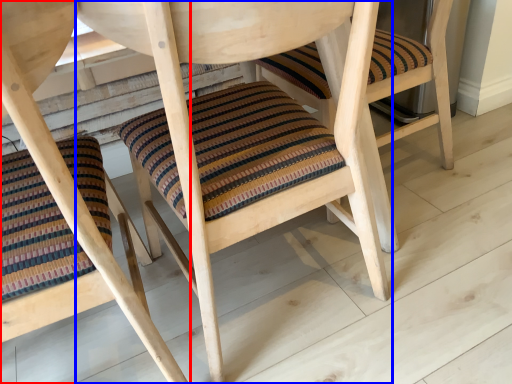
Question: Which object is further to the camera taking this photo, chair (highlighted by a red box) or chair (highlighted by a blue box)?

Choices:
 (A) chair
 (B) chair

Answer: (B)